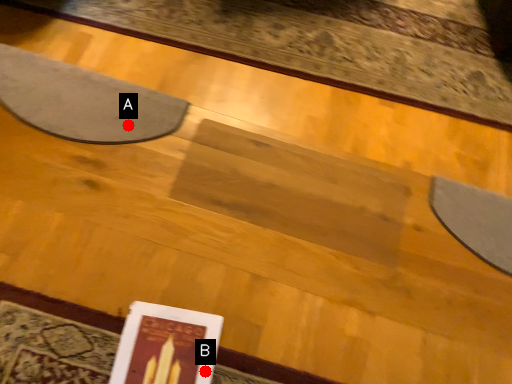
Question: Two points are circled on the image, labeled by A and B beside each circle. Which point is closer to the camera taking this photo?

Choices:
 (A) A is closer
 (B) B is closer

Answer: (B)